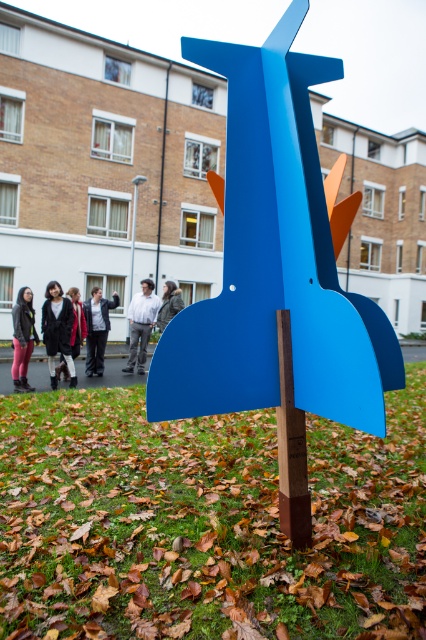
You are standing in front of the sculpture and see two people wearing jackets at the center. Which jacket is closer to you, the matte black jacket at center or the dark gray jacket at center?

The matte black jacket at center is closer to you because it is in front of the dark gray jacket at center.